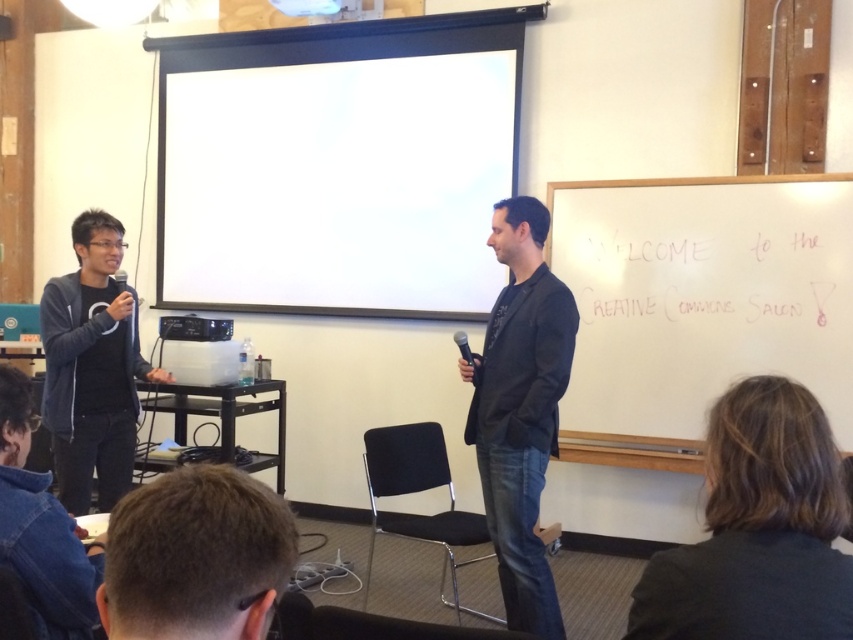
Question: Which object is positioned closest to the black matte suit at center?

Choices:
 (A) dark gray suit at lower right
 (B) dark gray zip-up jacket at left

Answer: (A)

Question: Can you confirm if black matte suit at center is positioned to the right of black plastic projector at center?

Choices:
 (A) no
 (B) yes

Answer: (B)

Question: Can you confirm if white matte projection screen at upper center is smaller than black matte suit at center?

Choices:
 (A) yes
 (B) no

Answer: (B)

Question: Does white matte projection screen at upper center appear on the right side of dark gray zip-up jacket at left?

Choices:
 (A) no
 (B) yes

Answer: (B)

Question: Which of these objects is positioned farthest from the denim jacket at lower left?

Choices:
 (A) dark gray suit at lower right
 (B) black plastic projector at center

Answer: (B)

Question: Which point is closer to the camera taking this photo?

Choices:
 (A) (256, 182)
 (B) (693, 625)
 (C) (457, 332)
 (D) (120, 618)

Answer: (D)